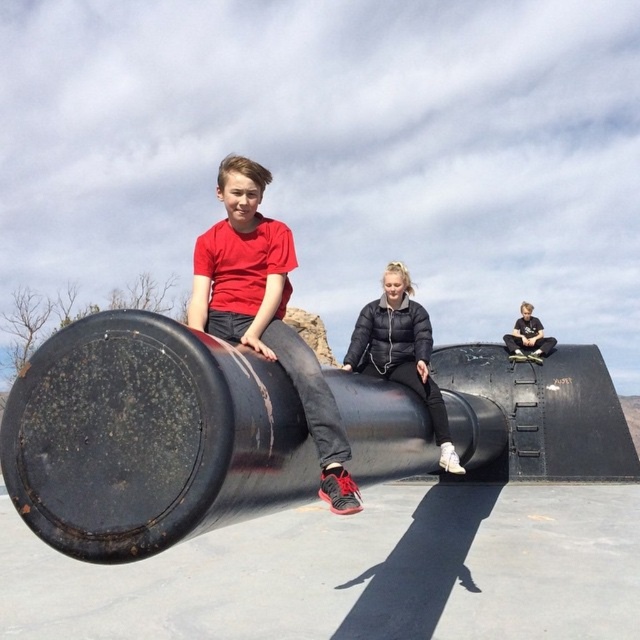
Is matte red shirt at center bigger than black puffy jacket at center?

Yes.

Which is in front, point (228, 232) or point (378, 372)?

Positioned in front is point (228, 232).

You are a GUI agent. You are given a task and a screenshot of the screen. Output one action in this format:
    pyautogui.click(x=<x>, y=<y>)
    Task: Click on the matte red shirt at center
    This screenshot has height=640, width=640.
    Given the screenshot: What is the action you would take?
    [x=266, y=310]

Does rusty metal cannon at center have a smaller size compared to black puffy jacket at center?

No, rusty metal cannon at center is not smaller than black puffy jacket at center.

Which of these two, rusty metal cannon at center or black puffy jacket at center, stands taller?

rusty metal cannon at center

Who is more distant from viewer, (131, 472) or (420, 321)?

The point (420, 321) is behind.

I want to click on rusty metal cannon at center, so click(148, 436).

Is the position of matte red shirt at center less distant than that of matte black jacket at center?

Yes, it is in front of matte black jacket at center.

Who is positioned more to the right, matte red shirt at center or matte black jacket at center?

From the viewer's perspective, matte black jacket at center appears more on the right side.

The image size is (640, 640). In order to click on matte red shirt at center in this screenshot , I will do `click(266, 310)`.

Where is `matte red shirt at center`? The height and width of the screenshot is (640, 640). matte red shirt at center is located at coordinates (266, 310).